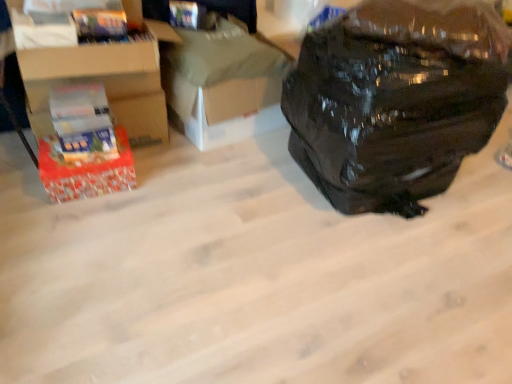
Describe the element at coordinates (393, 103) in the screenshot. I see `black matte backpack at right` at that location.

In the scene shown: What is the approximate height of black matte backpack at right?

black matte backpack at right is 76.44 centimeters tall.

Locate an element on the screen. white cardboard box at center, which is the first cardboard box in right-to-left order is located at coordinates (222, 85).

Locate an element on the screen. Image resolution: width=512 pixels, height=384 pixels. cardboard box below the cardboard box at left, the first cardboard box in the left-to-right sequence (from the image's perspective) is located at coordinates (222, 85).

Are white cardboard box at center, marked as the second cardboard box in a left-to-right arrangement, and cardboard box at left, the first cardboard box in the left-to-right sequence, far apart?

No.

Measure the distance from white cardboard box at center, marked as the second cardboard box in a left-to-right arrangement, to cardboard box at left, placed as the 2th cardboard box when sorted from right to left.

They are 12.59 inches apart.

Is white cardboard box at center, marked as the second cardboard box in a left-to-right arrangement, in front of cardboard box at left, placed as the 2th cardboard box when sorted from right to left?

No, white cardboard box at center, marked as the second cardboard box in a left-to-right arrangement, is further to the viewer.

In the image, is black matte backpack at right positioned in front of or behind cardboard box at left, the first cardboard box in the left-to-right sequence?

black matte backpack at right is in front of cardboard box at left, the first cardboard box in the left-to-right sequence.

From their relative heights in the image, would you say black matte backpack at right is taller or shorter than cardboard box at left, the first cardboard box in the left-to-right sequence?

Considering their sizes, black matte backpack at right has more height than cardboard box at left, the first cardboard box in the left-to-right sequence.

Between point (466, 132) and point (40, 72), which one is positioned behind?

Point (466, 132)

Based on their positions, is black matte backpack at right located to the left or right of cardboard box at left, the first cardboard box in the left-to-right sequence?

black matte backpack at right is positioned on cardboard box at left, the first cardboard box in the left-to-right sequence,'s right side.

Would you say white cardboard box at center, marked as the second cardboard box in a left-to-right arrangement, is inside or outside red cardboard box at left?

white cardboard box at center, marked as the second cardboard box in a left-to-right arrangement, cannot be found inside red cardboard box at left.

Is white cardboard box at center, which is the first cardboard box in right-to-left order, at the left side of red cardboard box at left?

In fact, white cardboard box at center, which is the first cardboard box in right-to-left order, is to the right of red cardboard box at left.

Is white cardboard box at center, which is the first cardboard box in right-to-left order, smaller than red cardboard box at left?

No, white cardboard box at center, which is the first cardboard box in right-to-left order, is not smaller than red cardboard box at left.

Does white cardboard box at center, marked as the second cardboard box in a left-to-right arrangement, come behind red cardboard box at left?

Yes, white cardboard box at center, marked as the second cardboard box in a left-to-right arrangement, is behind red cardboard box at left.

Could you tell me if red cardboard box at left is turned towards black matte backpack at right?

No, red cardboard box at left is not oriented towards black matte backpack at right.

Does red cardboard box at left have a lesser height compared to black matte backpack at right?

Yes, red cardboard box at left is shorter than black matte backpack at right.

Considering the relative positions of red cardboard box at left and black matte backpack at right in the image provided, is red cardboard box at left to the left of black matte backpack at right from the viewer's perspective?

Yes, red cardboard box at left is to the left of black matte backpack at right.

Locate an element on the screen. The width and height of the screenshot is (512, 384). box located underneath the white cardboard box at center, which is the first cardboard box in right-to-left order (from a real-world perspective) is located at coordinates (87, 172).

How many degrees apart are the facing directions of red cardboard box at left and white cardboard box at center, which is the first cardboard box in right-to-left order?

15.3 degrees.

From the image's perspective, which object appears higher, red cardboard box at left or white cardboard box at center, which is the first cardboard box in right-to-left order?

white cardboard box at center, which is the first cardboard box in right-to-left order, is shown above in the image.

Does red cardboard box at left appear on the left side of white cardboard box at center, which is the first cardboard box in right-to-left order?

Yes, red cardboard box at left is to the left of white cardboard box at center, which is the first cardboard box in right-to-left order.

Is cardboard box at left, the first cardboard box in the left-to-right sequence, bigger than black matte backpack at right?

Actually, cardboard box at left, the first cardboard box in the left-to-right sequence, might be smaller than black matte backpack at right.

Based on the photo, is cardboard box at left, placed as the 2th cardboard box when sorted from right to left, wider than black matte backpack at right?

No, cardboard box at left, placed as the 2th cardboard box when sorted from right to left, is not wider than black matte backpack at right.

Between cardboard box at left, the first cardboard box in the left-to-right sequence, and black matte backpack at right, which one appears on the right side from the viewer's perspective?

Positioned to the right is black matte backpack at right.

Which cardboard box is the 2nd one when counting from the left side of the black matte backpack at right? Please provide its 2D coordinates.

[(102, 82)]

From the image's perspective, starting from the black matte backpack at right, which cardboard box is the 1st one above? Please provide its 2D coordinates.

[(222, 85)]

From the image's perspective, which is below, black matte backpack at right or white cardboard box at center, marked as the second cardboard box in a left-to-right arrangement?

black matte backpack at right.

Considering their positions, is black matte backpack at right located in front of or behind white cardboard box at center, which is the first cardboard box in right-to-left order?

Clearly, black matte backpack at right is in front of white cardboard box at center, which is the first cardboard box in right-to-left order.

Which of these two, black matte backpack at right or white cardboard box at center, which is the first cardboard box in right-to-left order, stands taller?

With more height is black matte backpack at right.

This screenshot has height=384, width=512. I want to click on cardboard box below the cardboard box at left, the first cardboard box in the left-to-right sequence (from the image's perspective), so pos(222,85).

Where is `backpack located in front of the cardboard box at left, placed as the 2th cardboard box when sorted from right to left`? backpack located in front of the cardboard box at left, placed as the 2th cardboard box when sorted from right to left is located at coordinates (393, 103).

From the picture: Considering their positions, is black matte backpack at right positioned further to white cardboard box at center, marked as the second cardboard box in a left-to-right arrangement, than cardboard box at left, the first cardboard box in the left-to-right sequence?

The object further to white cardboard box at center, marked as the second cardboard box in a left-to-right arrangement, is black matte backpack at right.

When comparing their distances from black matte backpack at right, does cardboard box at left, the first cardboard box in the left-to-right sequence, or white cardboard box at center, which is the first cardboard box in right-to-left order, seem further?

Among the two, cardboard box at left, the first cardboard box in the left-to-right sequence, is located further to black matte backpack at right.

Considering their positions, is white cardboard box at center, which is the first cardboard box in right-to-left order, positioned closer to black matte backpack at right than cardboard box at left, the first cardboard box in the left-to-right sequence?

white cardboard box at center, which is the first cardboard box in right-to-left order.

Looking at the image, which one is located further to black matte backpack at right, white cardboard box at center, marked as the second cardboard box in a left-to-right arrangement, or red cardboard box at left?

red cardboard box at left lies further to black matte backpack at right than the other object.

Looking at the image, which one is located further to white cardboard box at center, marked as the second cardboard box in a left-to-right arrangement, cardboard box at left, placed as the 2th cardboard box when sorted from right to left, or black matte backpack at right?

The object further to white cardboard box at center, marked as the second cardboard box in a left-to-right arrangement, is black matte backpack at right.

When comparing their distances from cardboard box at left, the first cardboard box in the left-to-right sequence, does white cardboard box at center, marked as the second cardboard box in a left-to-right arrangement, or black matte backpack at right seem closer?

The object closer to cardboard box at left, the first cardboard box in the left-to-right sequence, is white cardboard box at center, marked as the second cardboard box in a left-to-right arrangement.

Considering their positions, is red cardboard box at left positioned closer to black matte backpack at right than cardboard box at left, placed as the 2th cardboard box when sorted from right to left?

cardboard box at left, placed as the 2th cardboard box when sorted from right to left, lies closer to black matte backpack at right than the other object.

Looking at the image, which one is located closer to cardboard box at left, the first cardboard box in the left-to-right sequence, black matte backpack at right or red cardboard box at left?

The object closer to cardboard box at left, the first cardboard box in the left-to-right sequence, is red cardboard box at left.

What are the coordinates of `cardboard box between red cardboard box at left and white cardboard box at center, which is the first cardboard box in right-to-left order` in the screenshot? It's located at (102, 82).

This screenshot has width=512, height=384. I want to click on cardboard box between cardboard box at left, the first cardboard box in the left-to-right sequence, and black matte backpack at right, in the horizontal direction, so click(x=222, y=85).